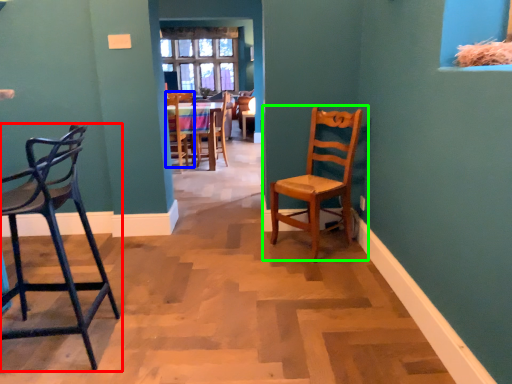
Question: Based on their relative distances, which object is farther from chair (highlighted by a red box)? Choose from chair (highlighted by a blue box) and chair (highlighted by a green box).

Choices:
 (A) chair
 (B) chair

Answer: (A)